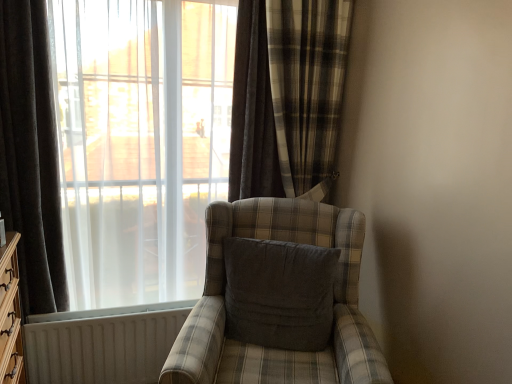
Question: Is white textured radiator at lower left not inside dark grey velvet curtain at left, placed as the second curtain when sorted from right to left?

Choices:
 (A) no
 (B) yes

Answer: (B)

Question: Can dark grey velvet curtain at left, placed as the second curtain when sorted from right to left, be found inside white textured radiator at lower left?

Choices:
 (A) yes
 (B) no

Answer: (B)

Question: From a real-world perspective, does white textured radiator at lower left stand above dark grey velvet curtain at left, the first curtain viewed from the left?

Choices:
 (A) no
 (B) yes

Answer: (A)

Question: Considering the relative positions of white textured radiator at lower left and dark grey velvet curtain at left, placed as the second curtain when sorted from right to left, in the image provided, is white textured radiator at lower left to the right of dark grey velvet curtain at left, placed as the second curtain when sorted from right to left, from the viewer's perspective?

Choices:
 (A) yes
 (B) no

Answer: (A)

Question: Is white textured radiator at lower left wider than dark grey velvet curtain at left, the first curtain viewed from the left?

Choices:
 (A) no
 (B) yes

Answer: (A)

Question: From the image's perspective, is white textured radiator at lower left located above dark grey velvet curtain at left, placed as the second curtain when sorted from right to left?

Choices:
 (A) no
 (B) yes

Answer: (A)

Question: Is plaid fabric chair at center a part of plaid fabric curtain at center, marked as the 1th curtain in a right-to-left arrangement?

Choices:
 (A) no
 (B) yes

Answer: (A)

Question: From a real-world perspective, is plaid fabric curtain at center, marked as the 1th curtain in a right-to-left arrangement, located higher than plaid fabric chair at center?

Choices:
 (A) yes
 (B) no

Answer: (A)

Question: Does plaid fabric curtain at center, marked as the 1th curtain in a right-to-left arrangement, come in front of plaid fabric chair at center?

Choices:
 (A) no
 (B) yes

Answer: (A)

Question: Can you confirm if plaid fabric curtain at center, marked as the 1th curtain in a right-to-left arrangement, is shorter than plaid fabric chair at center?

Choices:
 (A) yes
 (B) no

Answer: (B)

Question: Can you see plaid fabric curtain at center, the second curtain from the left, touching plaid fabric chair at center?

Choices:
 (A) yes
 (B) no

Answer: (B)

Question: Is plaid fabric curtain at center, marked as the 1th curtain in a right-to-left arrangement, wider than plaid fabric chair at center?

Choices:
 (A) yes
 (B) no

Answer: (B)

Question: Is transparent fabric at left in contact with dark grey velvet curtain at left, placed as the second curtain when sorted from right to left?

Choices:
 (A) no
 (B) yes

Answer: (A)